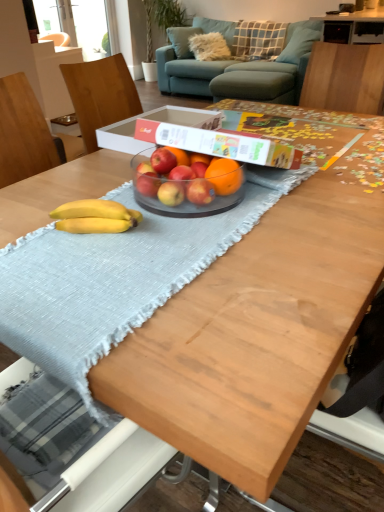
Where is `vacant area that is in front of orange matte at center`? The height and width of the screenshot is (512, 384). vacant area that is in front of orange matte at center is located at coordinates (198, 229).